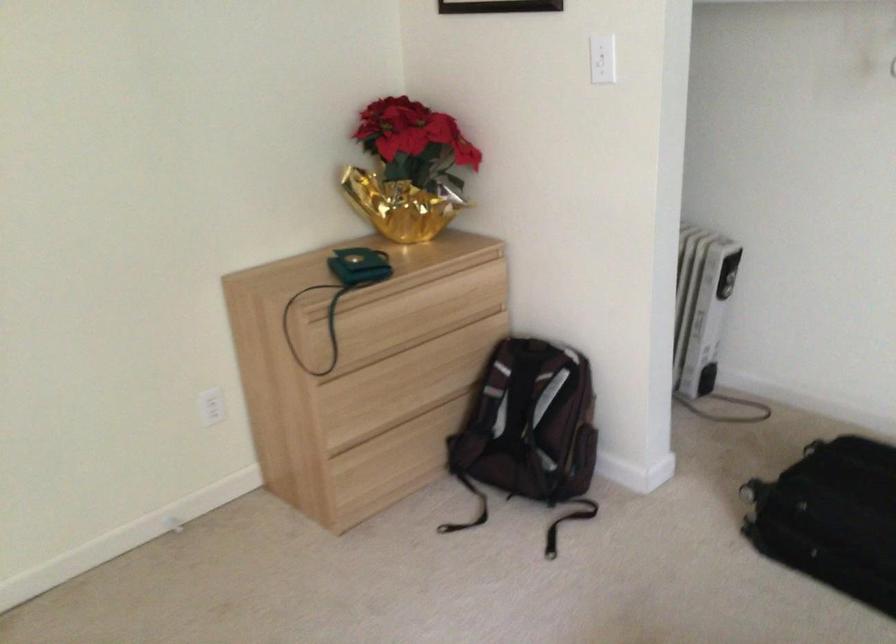
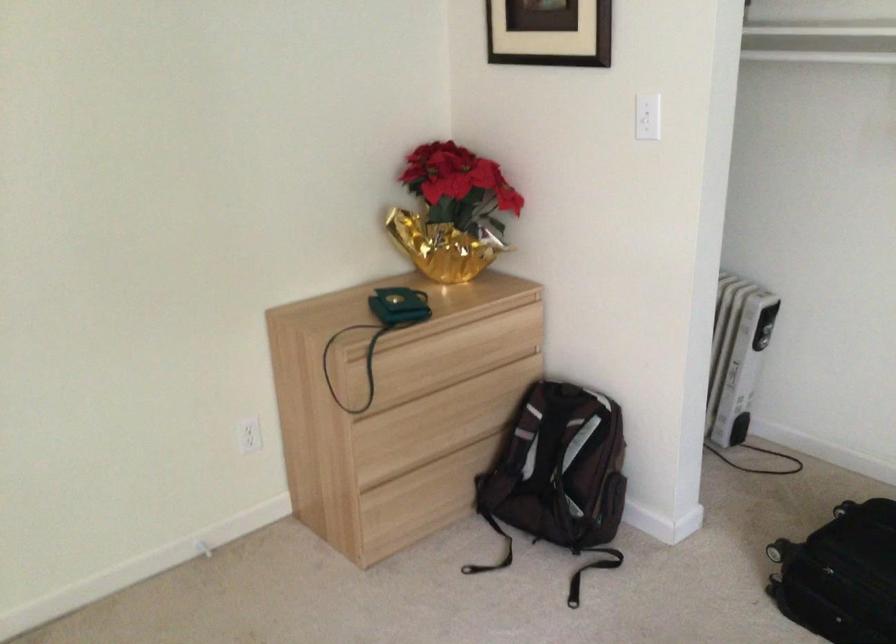
Locate, in the second image, the point that corresponds to point (724, 288) in the first image.

(761, 339)